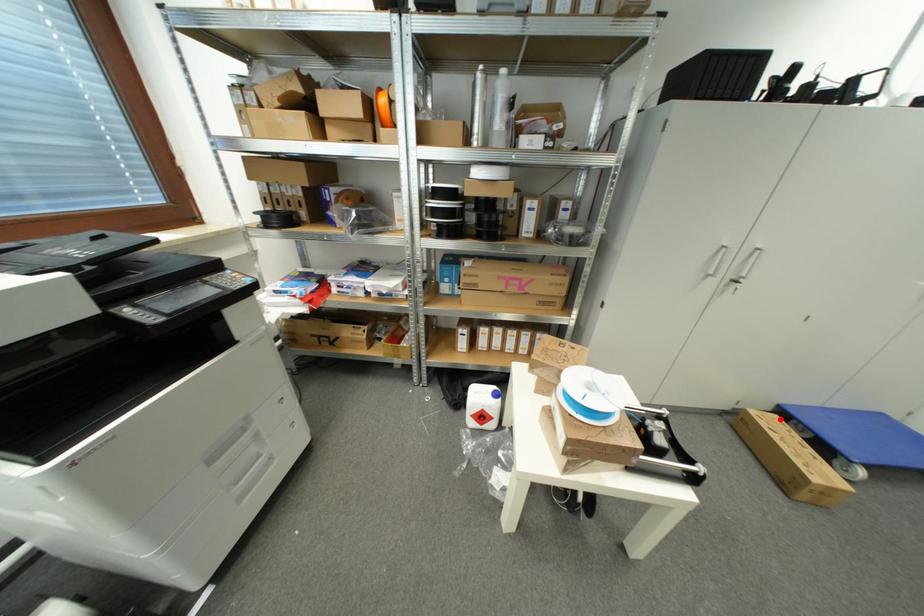
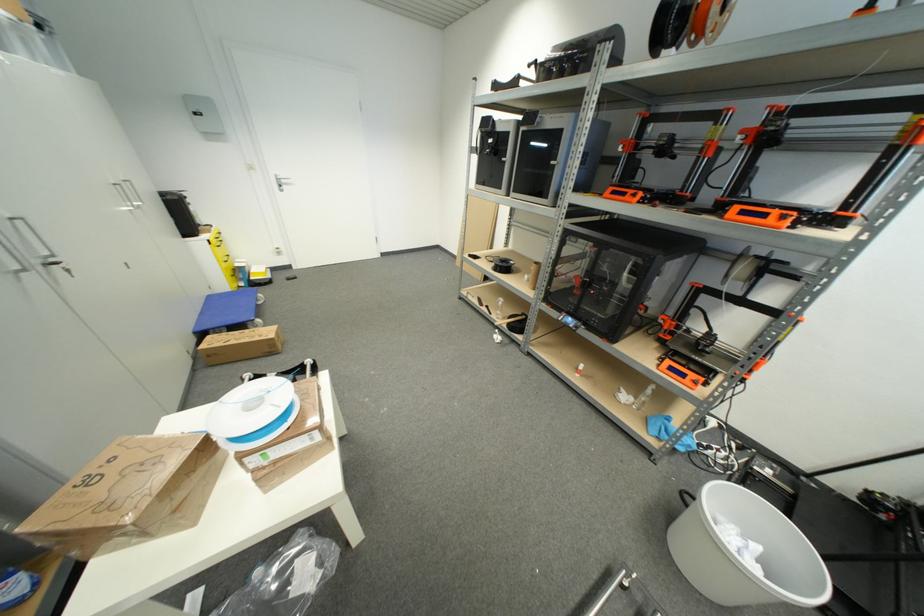
The point at the highlighted location is marked in the first image. Where is the corresponding point in the second image?

(213, 339)